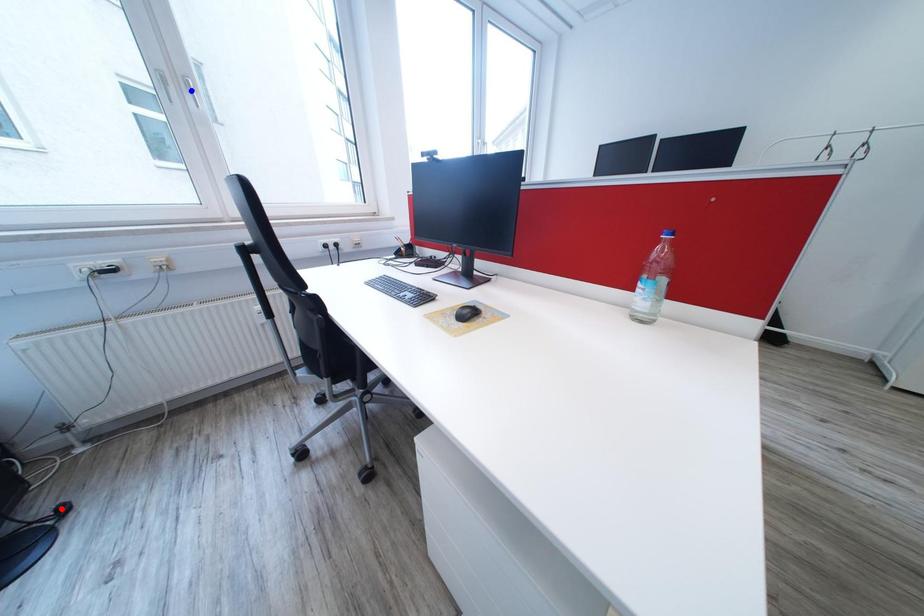
Question: Two points are marked on the image. Which point is closer to the camera?

Choices:
 (A) Blue point is closer.
 (B) Red point is closer.

Answer: (B)